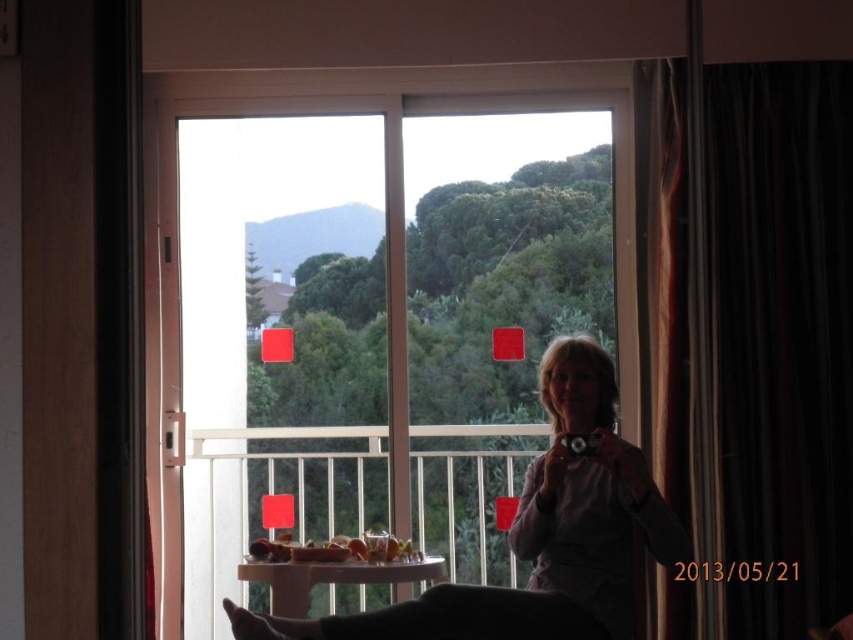
You are a photographer trying to capture a clear shot of the matte purple shirt at center and the green matte mountain at upper left in the scene. Based on their distance, can you focus on both objects simultaneously with your camera lens set to a standard aperture of f8? Explain your reasoning.

The matte purple shirt at center is 23.20 inches away from the green matte mountain at upper left. At f8 aperture, the depth of field would likely keep both objects in focus since the distance between them is relatively small.

You are standing in the room and want to move from the black velvet curtain at right to the white plastic table at center. Which direction should you move towards?

The black velvet curtain at right is to the right of the white plastic table at center, so you should move to the left to reach the table from the curtain.